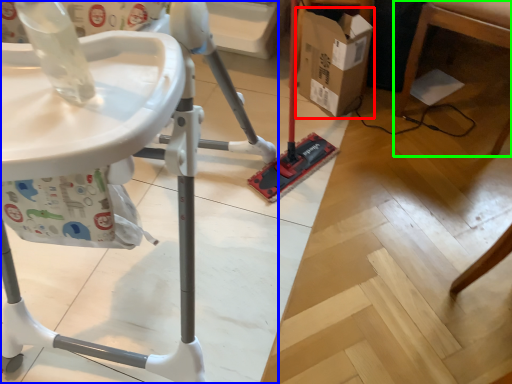
Question: Which is farther away from cardboard box (highlighted by a red box)? furniture (highlighted by a blue box) or furniture (highlighted by a green box)?

Choices:
 (A) furniture
 (B) furniture

Answer: (A)